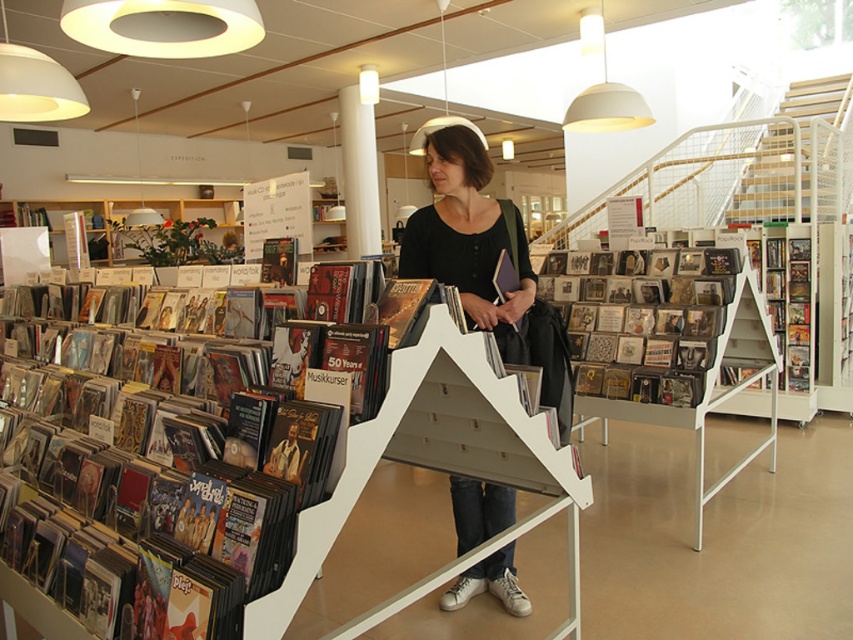
You are a customer in the record store and want to place both the matte black vinyl records at left and the matte black book at center on a shelf that can only hold items up to the height of the taller object. Which object should you use to determine the maximum height allowed?

The matte black book at center is taller than the matte black vinyl records at left, so you should use the matte black book at center to determine the maximum height allowed.